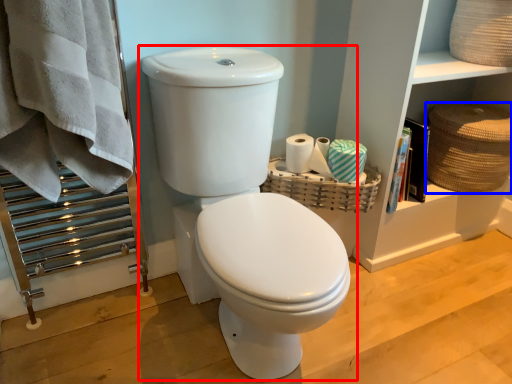
Question: Among these objects, which one is farthest to the camera, toilet (highlighted by a red box) or basket (highlighted by a blue box)?

Choices:
 (A) toilet
 (B) basket

Answer: (B)